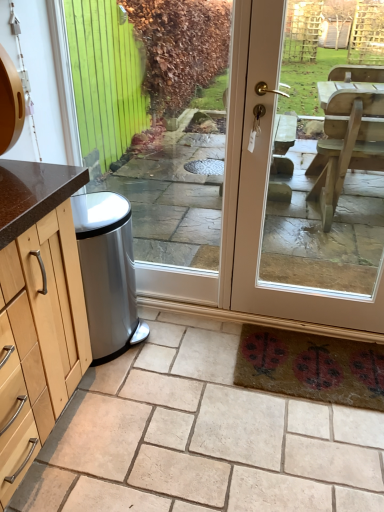
Question: Looking at their shapes, would you say clear glass door at center is wider or thinner than matte beige door at center?

Choices:
 (A) wide
 (B) thin

Answer: (B)

Question: Considering their positions, is clear glass door at center located in front of or behind matte beige door at center?

Choices:
 (A) behind
 (B) front

Answer: (A)

Question: Which is farther from the matte beige door at center?

Choices:
 (A) satin silver trash can at lower left
 (B) clear glass door at center

Answer: (B)

Question: Which object is positioned farthest from the satin silver trash can at lower left?

Choices:
 (A) matte beige door at center
 (B) clear glass door at center

Answer: (B)